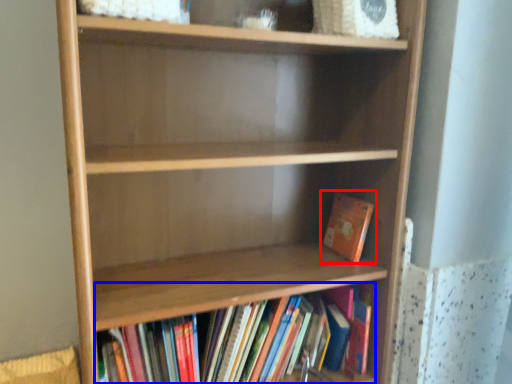
Question: Which of the following is the closest to the observer, book (highlighted by a red box) or book (highlighted by a blue box)?

Choices:
 (A) book
 (B) book

Answer: (B)